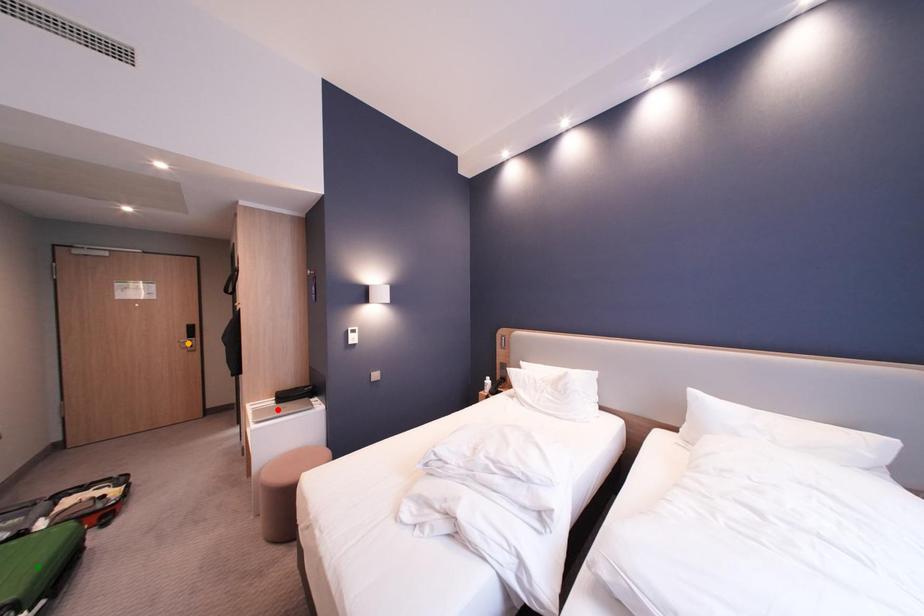
Order these from nearest to farthest:
green point, red point, orange point

green point, red point, orange point